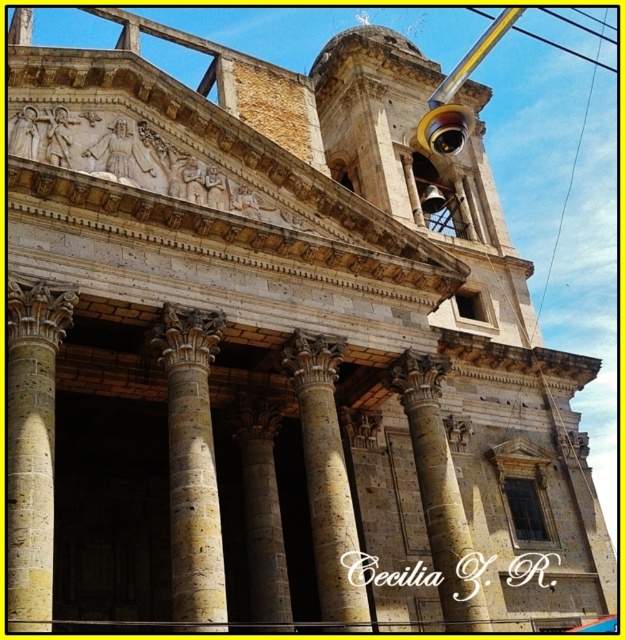
Can you confirm if stone column at left is positioned to the right of marble column at center?

In fact, stone column at left is to the left of marble column at center.

Does stone column at left lie behind marble column at center?

No, it is in front of marble column at center.

This screenshot has width=625, height=640. I want to click on stone column at left, so pyautogui.click(x=32, y=444).

Who is positioned more to the left, marble column at center or brown stone column at center?

Positioned to the left is brown stone column at center.

Who is higher up, marble column at center or brown stone column at center?

marble column at center is above.

Which is in front, point (288, 365) or point (268, 584)?

Positioned in front is point (288, 365).

You are a GUI agent. You are given a task and a screenshot of the screen. Output one action in this format:
    pyautogui.click(x=<x>, y=<y>)
    Task: Click on the marble column at center
    This screenshot has height=640, width=625.
    Given the screenshot: What is the action you would take?
    pyautogui.click(x=326, y=474)

Which is more to the left, stone column at left or stone textured column at center?

stone column at left is more to the left.

In the scene shown: Who is more distant from viewer, (16,547) or (422,416)?

The point (422,416) is more distant.

Image resolution: width=625 pixels, height=640 pixels. What are the coordinates of `stone column at left` in the screenshot? It's located at (32, 444).